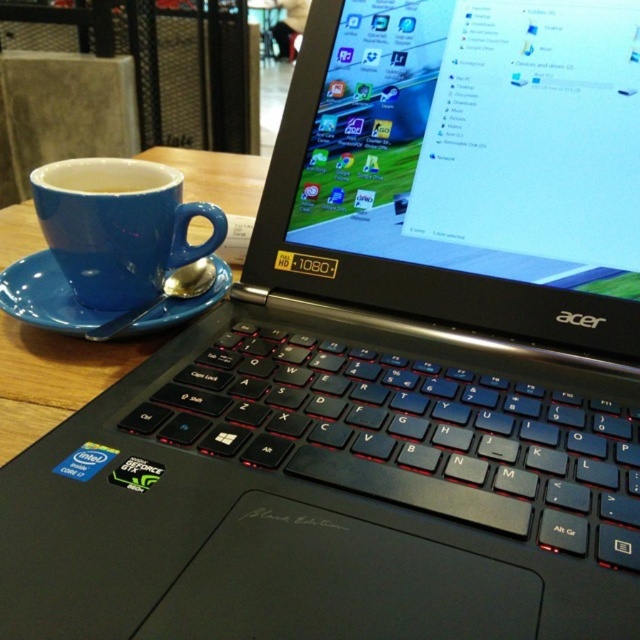
Who is positioned more to the right, blue ceramic cup at left or blue matte saucer at left?

blue matte saucer at left is more to the right.

Is blue ceramic cup at left wider than blue matte saucer at left?

Yes, blue ceramic cup at left is wider than blue matte saucer at left.

Is point (77, 346) more distant than point (99, 339)?

Yes.

This screenshot has width=640, height=640. In order to click on blue ceramic cup at left in this screenshot , I will do `click(49, 380)`.

Which is more to the left, matte blue mug at left or blue matte saucer at left?

Positioned to the left is blue matte saucer at left.

In the scene shown: Measure the distance between point (102,280) and camera.

They are 41.86 centimeters apart.

This screenshot has height=640, width=640. I want to click on matte blue mug at left, so click(118, 227).

The width and height of the screenshot is (640, 640). Find the location of `matte blue mug at left`. matte blue mug at left is located at coordinates (118, 227).

Can you confirm if matte blue mug at left is smaller than blue ceramic cup at left?

Yes.

Is matte blue mug at left in front of blue ceramic cup at left?

That is False.

Between point (124, 296) and point (250, 156), which one is positioned in front?

Point (124, 296) is more forward.

Find the location of a particular element. Image resolution: width=640 pixels, height=640 pixels. matte blue mug at left is located at coordinates (118, 227).